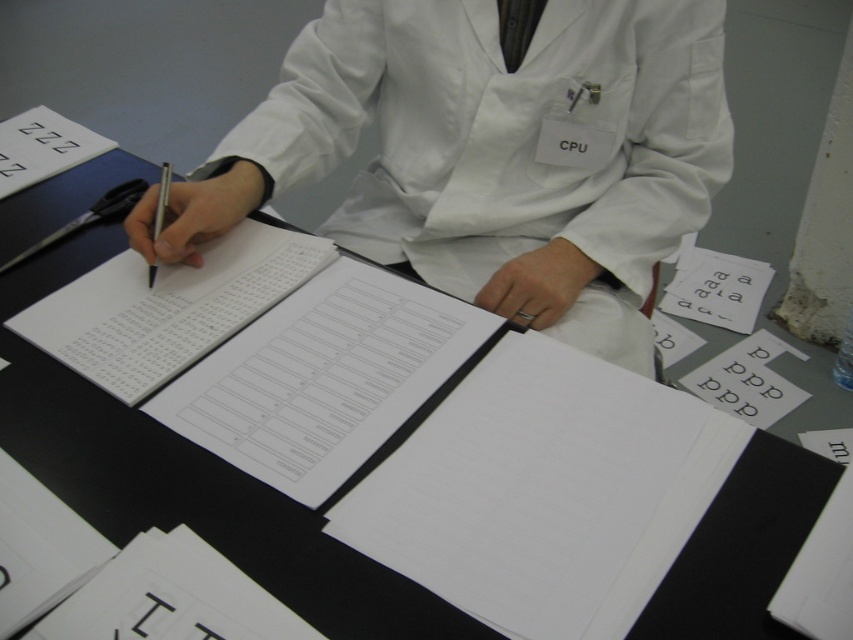
Question: Is white smooth lab coat at center smaller than metallic silver pen at left?

Choices:
 (A) no
 (B) yes

Answer: (A)

Question: Is white smooth lab coat at center below metallic silver pen at left?

Choices:
 (A) no
 (B) yes

Answer: (A)

Question: Among these points, which one is nearest to the camera?

Choices:
 (A) (700, 38)
 (B) (167, 196)

Answer: (B)

Question: Does white smooth lab coat at center lie in front of metallic silver pen at left?

Choices:
 (A) no
 (B) yes

Answer: (A)